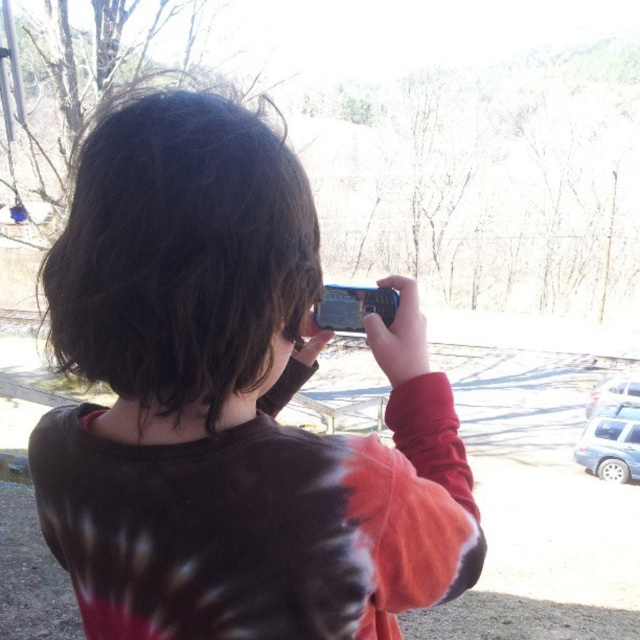
Can you confirm if matte tie-dye shirt at center is thinner than blue plastic smartphone at center?

In fact, matte tie-dye shirt at center might be wider than blue plastic smartphone at center.

Between matte tie-dye shirt at center and blue plastic smartphone at center, which one appears on the right side from the viewer's perspective?

Positioned to the right is blue plastic smartphone at center.

Who is more distant from viewer, (x=316, y=604) or (x=332, y=312)?

The point (x=332, y=312) is behind.

Where is `matte tie-dye shirt at center`? Image resolution: width=640 pixels, height=640 pixels. matte tie-dye shirt at center is located at coordinates (230, 403).